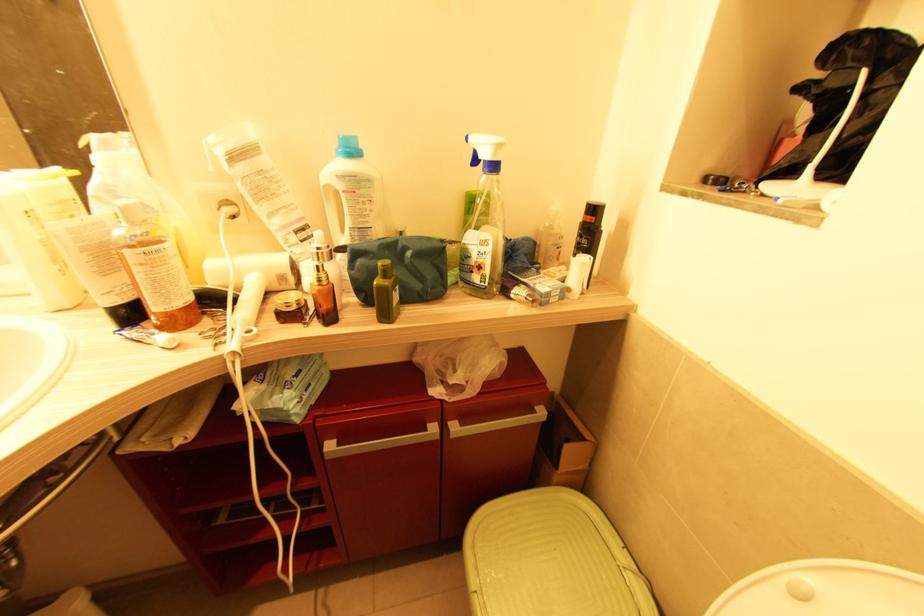
The width and height of the screenshot is (924, 616). Find the location of `green trash can lid`. green trash can lid is located at coordinates (550, 559).